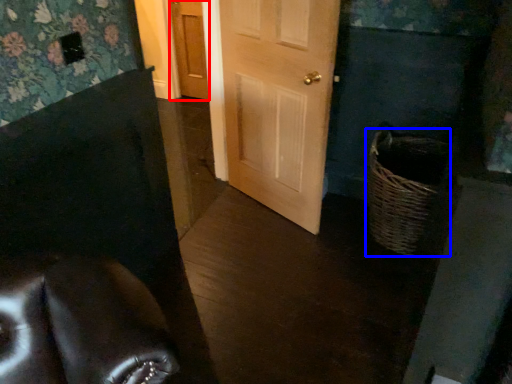
Question: Which object appears closest to the camera in this image, door (highlighted by a red box) or basket (highlighted by a blue box)?

Choices:
 (A) door
 (B) basket

Answer: (B)